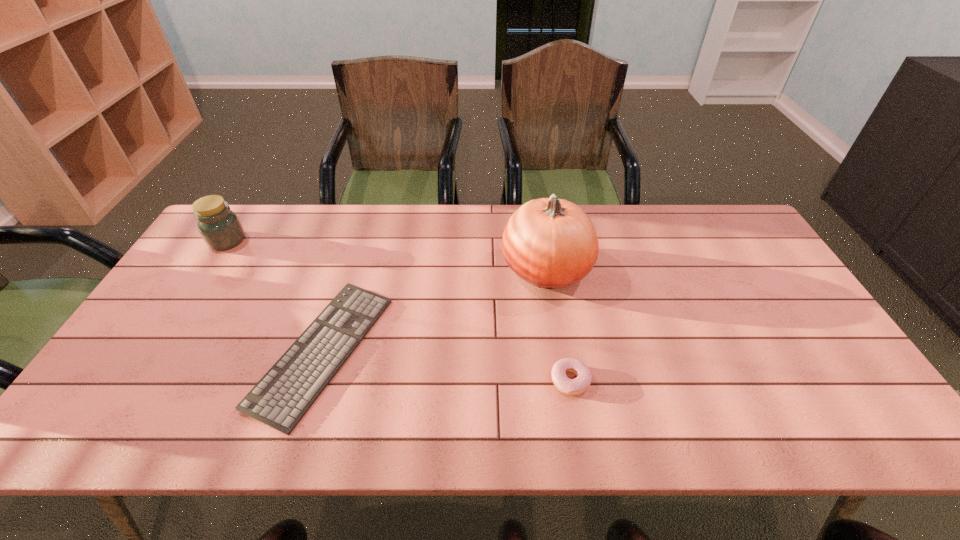
Locate an element on the screen. This screenshot has height=540, width=960. the tallest object is located at coordinates (551, 243).

Where is `jar`? jar is located at coordinates (220, 228).

The width and height of the screenshot is (960, 540). What are the coordinates of `the third shortest object` in the screenshot? It's located at (220, 228).

What are the coordinates of `the third tallest object` in the screenshot? It's located at (580, 384).

At what (x,y) coordinates should I click in order to perform the action: click on the third object from right to left. Please return your answer as a coordinate pair (x, y). Looking at the image, I should click on (281, 398).

At what (x,y) coordinates should I click in order to perform the action: click on the shortest object. Please return your answer as a coordinate pair (x, y). This screenshot has width=960, height=540. Looking at the image, I should click on tap(281, 398).

In order to click on vacant area located 0.100m on the front of the pumpkin in this screenshot , I will do `click(556, 330)`.

The width and height of the screenshot is (960, 540). In order to click on free spot located on the right of the second tallest object in this screenshot , I will do `click(316, 241)`.

At what (x,y) coordinates should I click in order to perform the action: click on vacant space positioned 0.330m on the right of the third tallest object. Please return your answer as a coordinate pair (x, y). Looking at the image, I should click on (728, 380).

I want to click on vacant area situated on the left of the third object from right to left, so click(x=217, y=351).